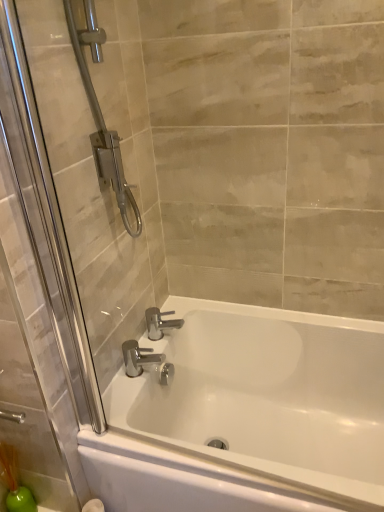
Question: Are polished chrome faucet at lower center, which appears as the 1th tap when viewed from the front, and chrome metallic faucet at center, placed as the first tap when sorted from back to front, making contact?

Choices:
 (A) yes
 (B) no

Answer: (B)

Question: Can you confirm if polished chrome faucet at lower center, the second tap from the back, is taller than chrome metallic faucet at center, arranged as the second tap when viewed from the front?

Choices:
 (A) yes
 (B) no

Answer: (A)

Question: Is polished chrome faucet at lower center, the second tap from the back, in front of chrome metallic faucet at center, placed as the first tap when sorted from back to front?

Choices:
 (A) no
 (B) yes

Answer: (B)

Question: Can you confirm if polished chrome faucet at lower center, the second tap from the back, is wider than chrome metallic faucet at center, arranged as the second tap when viewed from the front?

Choices:
 (A) yes
 (B) no

Answer: (B)

Question: Can we say polished chrome faucet at lower center, which appears as the 1th tap when viewed from the front, lies outside chrome metallic faucet at center, arranged as the second tap when viewed from the front?

Choices:
 (A) yes
 (B) no

Answer: (A)

Question: Is polished chrome faucet at lower center, the second tap from the back, positioned behind chrome metallic faucet at center, placed as the first tap when sorted from back to front?

Choices:
 (A) no
 (B) yes

Answer: (A)

Question: Can you confirm if white glossy bathtub at center is positioned to the left of chrome metallic faucet at center, placed as the first tap when sorted from back to front?

Choices:
 (A) no
 (B) yes

Answer: (A)

Question: Is white glossy bathtub at center beside chrome metallic faucet at center, arranged as the second tap when viewed from the front?

Choices:
 (A) yes
 (B) no

Answer: (B)

Question: Can you confirm if white glossy bathtub at center is wider than chrome metallic faucet at center, arranged as the second tap when viewed from the front?

Choices:
 (A) no
 (B) yes

Answer: (B)

Question: From a real-world perspective, is white glossy bathtub at center on chrome metallic faucet at center, arranged as the second tap when viewed from the front?

Choices:
 (A) no
 (B) yes

Answer: (A)

Question: Is white glossy bathtub at center facing towards chrome metallic faucet at center, placed as the first tap when sorted from back to front?

Choices:
 (A) no
 (B) yes

Answer: (A)

Question: Is chrome metallic faucet at center, placed as the first tap when sorted from back to front, at the back of white glossy bathtub at center?

Choices:
 (A) no
 (B) yes

Answer: (A)

Question: From the image's perspective, does chrome metallic faucet at center, arranged as the second tap when viewed from the front, appear lower than white glossy bathtub at center?

Choices:
 (A) yes
 (B) no

Answer: (B)